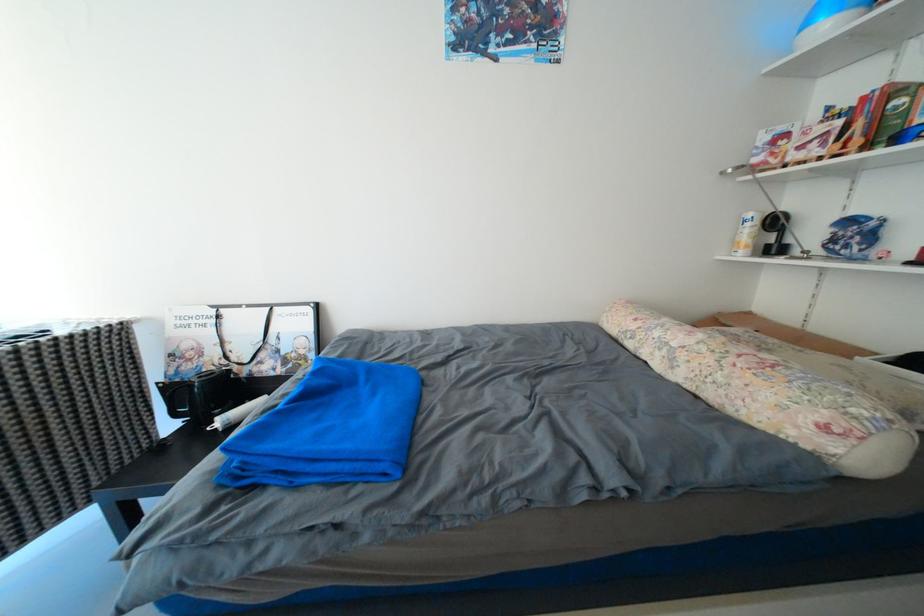
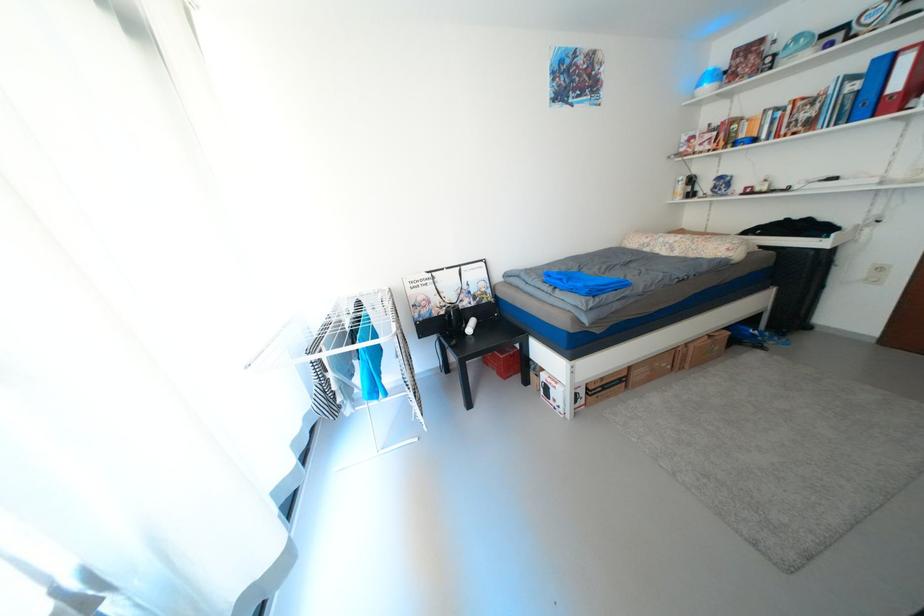
The point at (x=811, y=30) is marked in the first image. Where is the corresponding point in the second image?

(707, 87)